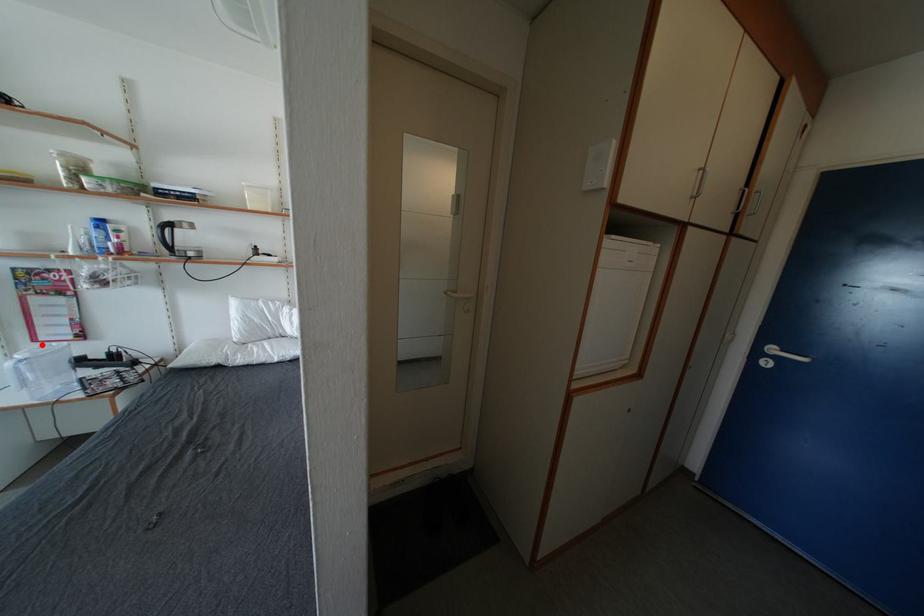
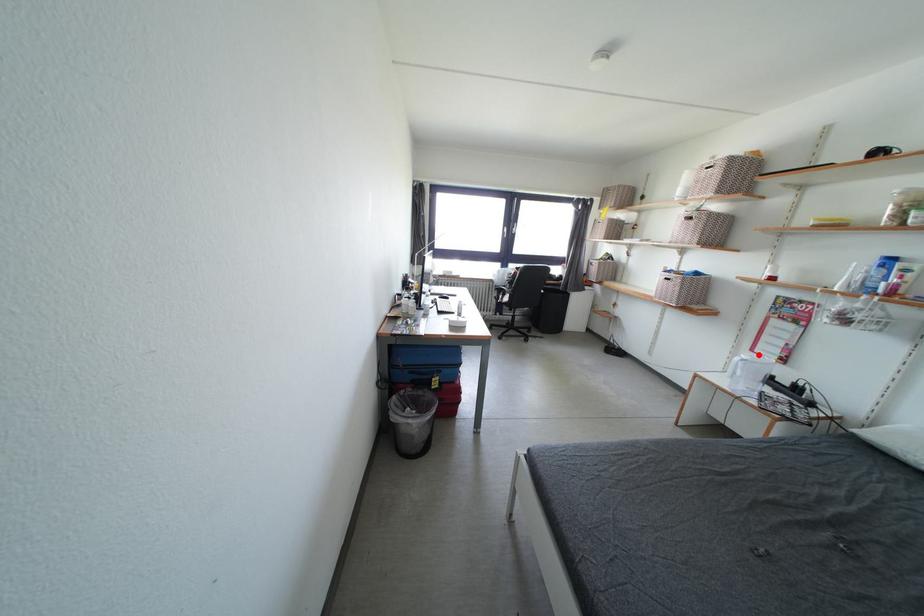
Consider the image. I am providing you with two images of the same scene from different viewpoints. A red point is marked on the first image and another point is marked on the second image. Is the red point in image1 aligned with the point shown in image2?

Yes